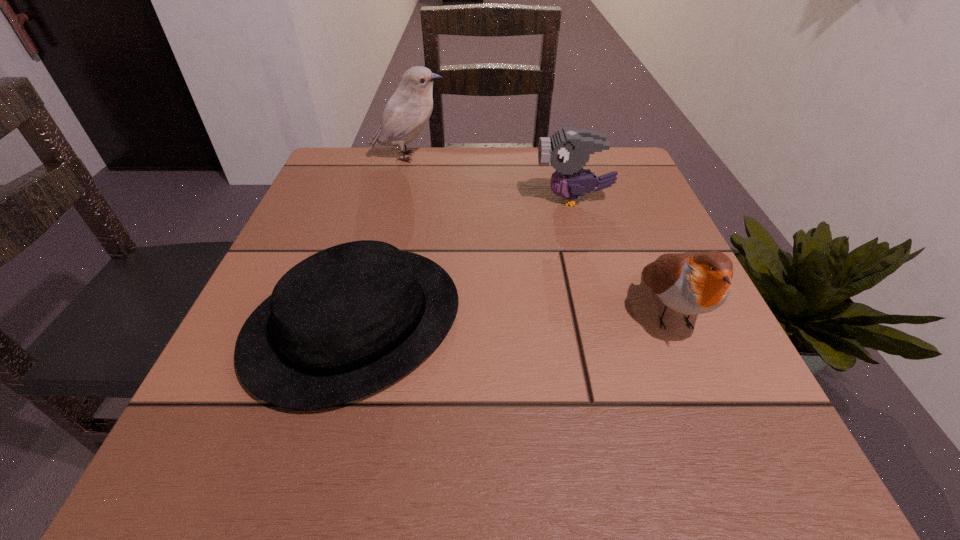
Where is `free spot located on the right of the fedora`? The width and height of the screenshot is (960, 540). free spot located on the right of the fedora is located at coordinates (572, 322).

This screenshot has height=540, width=960. I want to click on bird present at the left edge, so click(x=408, y=110).

The image size is (960, 540). I want to click on fedora positioned at the left edge, so click(x=345, y=322).

The height and width of the screenshot is (540, 960). In order to click on object present at the far left corner in this screenshot , I will do `click(408, 110)`.

This screenshot has width=960, height=540. Find the location of `object at the far right corner`. object at the far right corner is located at coordinates (568, 149).

Find the location of a particular element. The image size is (960, 540). free location at the far edge is located at coordinates (395, 175).

I want to click on free space at the near edge of the desktop, so click(617, 431).

The height and width of the screenshot is (540, 960). Identify the location of vacant space at the left edge of the desktop. (297, 228).

At what (x,y) coordinates should I click in order to perform the action: click on vacant space at the right edge of the desktop. Please return your answer as a coordinate pair (x, y). Image resolution: width=960 pixels, height=540 pixels. Looking at the image, I should click on (667, 373).

Find the location of a particular element. This screenshot has height=540, width=960. vacant region at the far left corner of the desktop is located at coordinates (346, 150).